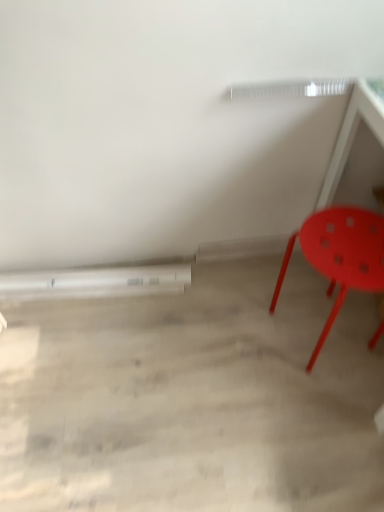
At what (x,y) coordinates should I click in order to perform the action: click on free space in front of matte plastic chair at right. Please return your answer as a coordinate pair (x, y). The height and width of the screenshot is (512, 384). Looking at the image, I should click on (322, 403).